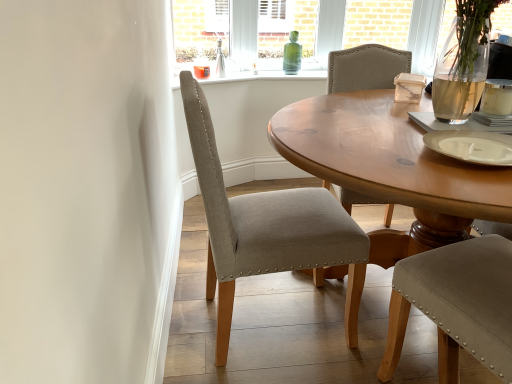
Question: In terms of size, does light gray fabric chair at center appear bigger or smaller than green glass bottle at center?

Choices:
 (A) big
 (B) small

Answer: (A)

Question: In the image, is light gray fabric chair at center positioned in front of or behind green glass bottle at center?

Choices:
 (A) front
 (B) behind

Answer: (A)

Question: Which is nearer to the light gray fabric chair at center?

Choices:
 (A) white ceramic coffee cup at upper right
 (B) green glass bottle at center
 (C) white matte plate at center-right

Answer: (C)

Question: Which of these objects is positioned closest to the white matte plate at center-right?

Choices:
 (A) light gray fabric chair at center
 (B) white ceramic coffee cup at upper right
 (C) green glass bottle at center

Answer: (B)